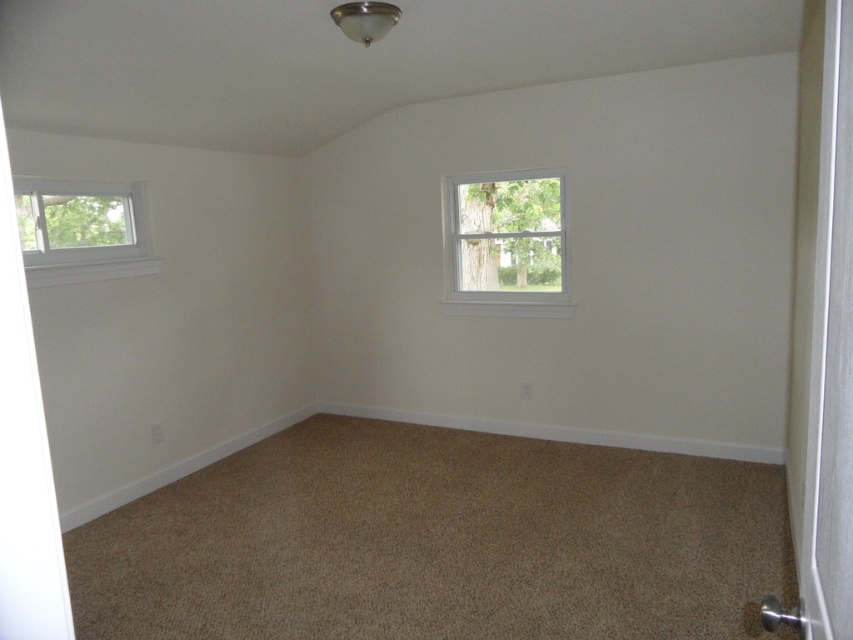
You are a painter who needs to place a ladder in this room to clean the windows. The ladder you have is 8 feet long. If you want to clean both the white wooden window at upper center and the clear glass window at upper left, will the ladder be long enough to reach both windows from the same spot?

The white wooden window at upper center is 8.38 feet from the clear glass window at upper left. Since the ladder is only 8 feet long, it is shorter than the distance between the two windows. Therefore, the ladder will not be long enough to reach both windows from the same spot.

You are an interior designer planning to install a new light fixture. You need to choose between placing it near the white wooden window at upper center or the clear glass window at upper left. Based on their sizes, which window would allow for a larger light fixture without blocking too much natural light?

The clear glass window at upper left occupies more space than the white wooden window at upper center, so placing the light fixture near the clear glass window at upper left would allow for a larger fixture without blocking too much natural light.